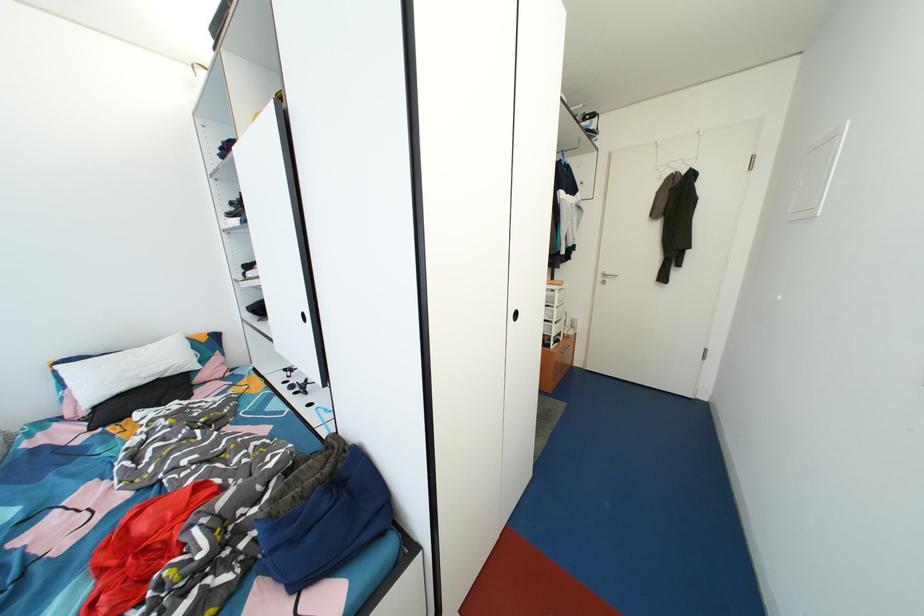
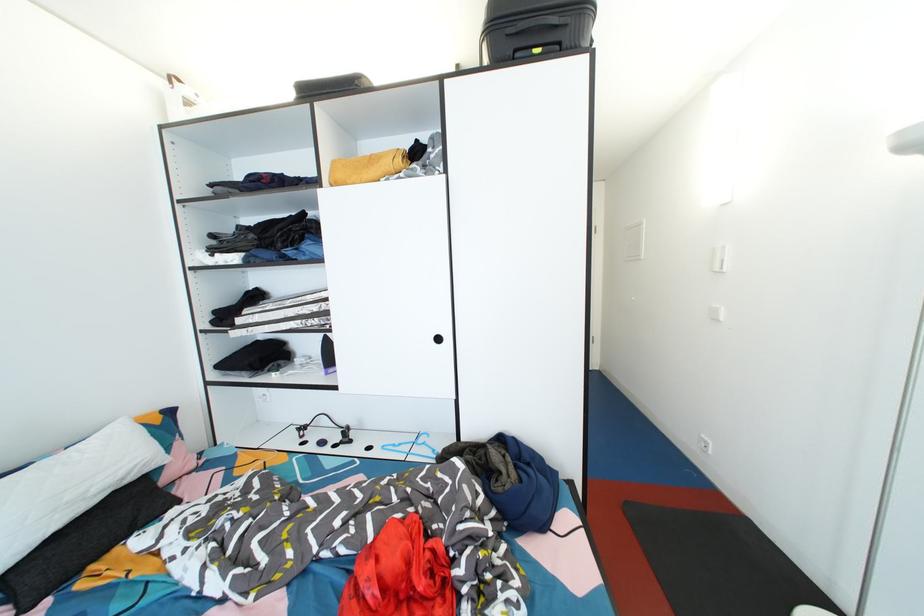
The point at (102, 413) is marked in the first image. Where is the corresponding point in the second image?

(8, 583)